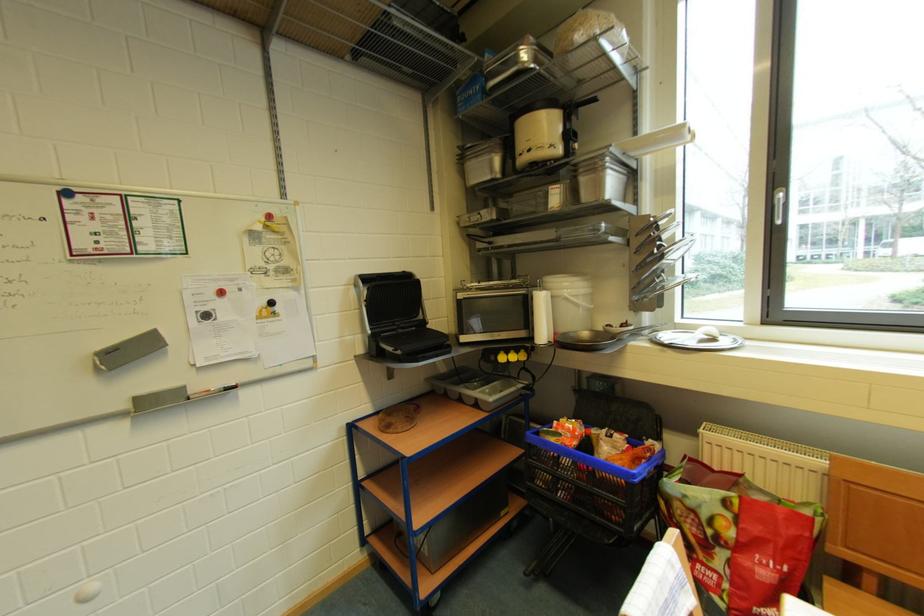
The height and width of the screenshot is (616, 924). What are the coordinates of `chair sitting surface` in the screenshot? It's located at (856, 601).